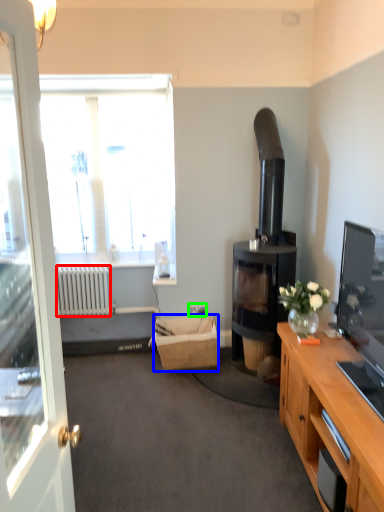
Question: Which is nearer to the radiator (highlighted by a red box)? picnic basket (highlighted by a blue box) or power outlet (highlighted by a green box).

Choices:
 (A) picnic basket
 (B) power outlet

Answer: (A)